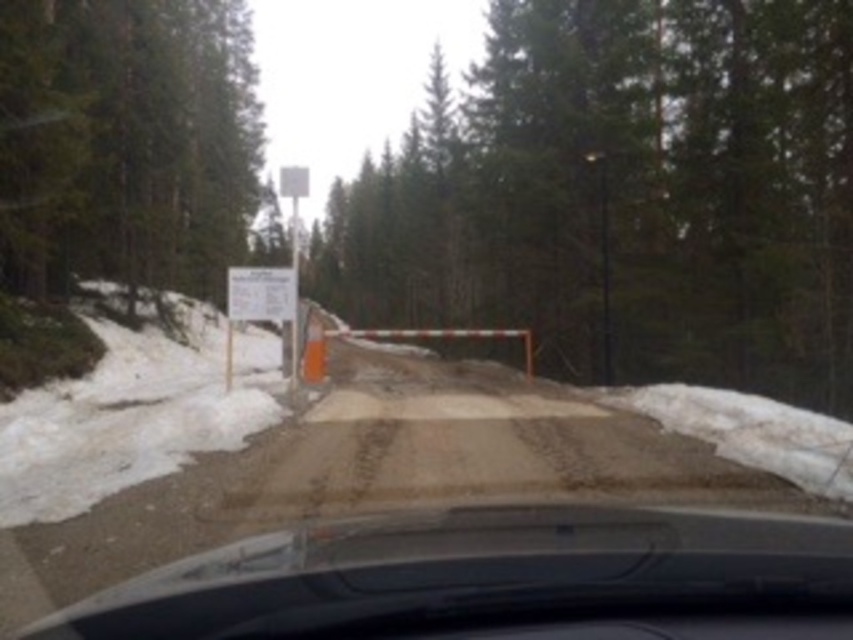
You are driving a car and see the green matte tree at upper left and the white paper sign at center from the driver seat. Which object is closer to you?

The green matte tree at upper left is closer to you because it is in front of the white paper sign at center.

You are driving a car with a length of 5.2 meters. You need to navigate through a narrow, unpaved road between the green matte tree at center and the green matte tree at upper left. Can your car fit through the gap between them?

The gap between the green matte tree at center and the green matte tree at upper left is 171.08 meters, which is significantly wider than the car length of 5.2 meters. Therefore, the car can easily fit through the gap between them.